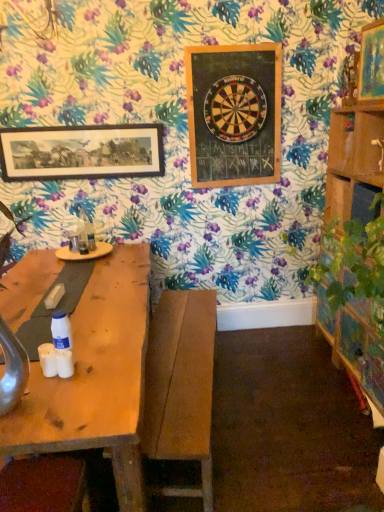
Question: Looking at their shapes, would you say wooden dartboard at upper center, the second picture frame in the front-to-back sequence, is wider or thinner than wooden picture frame at upper right, arranged as the 1th picture frame when viewed from the right?

Choices:
 (A) thin
 (B) wide

Answer: (A)

Question: Is wooden dartboard at upper center, positioned as the second picture frame in back-to-front order, inside or outside of wooden picture frame at upper right, positioned as the first picture frame in front-to-back order?

Choices:
 (A) inside
 (B) outside

Answer: (B)

Question: Considering the real-world distances, which object is farthest from the wooden dartboard at upper center, positioned as the second picture frame in back-to-front order?

Choices:
 (A) wooden picture frame at upper right, positioned as the first picture frame in front-to-back order
 (B) wooden framed print at upper left, marked as the 1th picture frame in a back-to-front arrangement
 (C) velvet brown cushion at lower left, placed as the 2th swivel chair when sorted from right to left
 (D) wooden bench at center, which is the 2th swivel chair in front-to-back order

Answer: (C)

Question: Which object is positioned closest to the velvet brown cushion at lower left, the first swivel chair positioned from the front?

Choices:
 (A) wooden dartboard at upper center, the 2th picture frame when ordered from right to left
 (B) wooden framed print at upper left, which is the third picture frame from right to left
 (C) wooden picture frame at upper right, arranged as the 1th picture frame when viewed from the right
 (D) wooden bench at center, placed as the first swivel chair when sorted from back to front

Answer: (D)